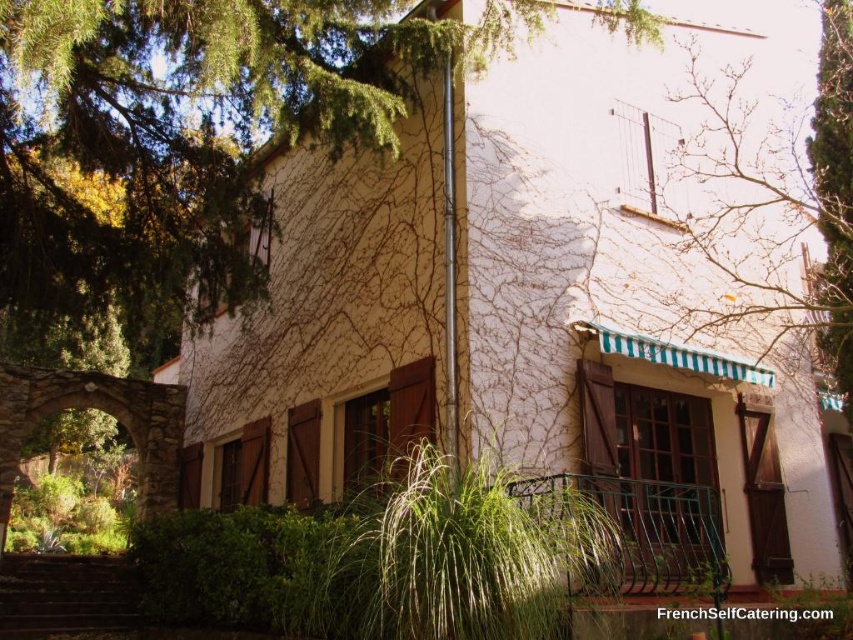
You are a painter standing at the base of the brown wooden stairs at lower left, planning to paint the green striped awning at upper right. To reach the awning, you need to climb the stairs. Are the stairs directly below the awning?

Yes, the green striped awning at upper right is positioned over the brown wooden stairs at lower left, so the stairs are directly below the awning.

In the scene shown: You are standing at the front door of the house and want to walk to a specific location. You see two points marked on the ground. The first point is at coordinate point (788, 300) and the second is at point (88, 627). Which point is closer to you as you face the house?

Point (88, 627) is closer to you because it is in front of point (788, 300), which is behind it.

What is the location of the green leafy tree at upper left in the image?

The green leafy tree at upper left is located at point (184, 140).